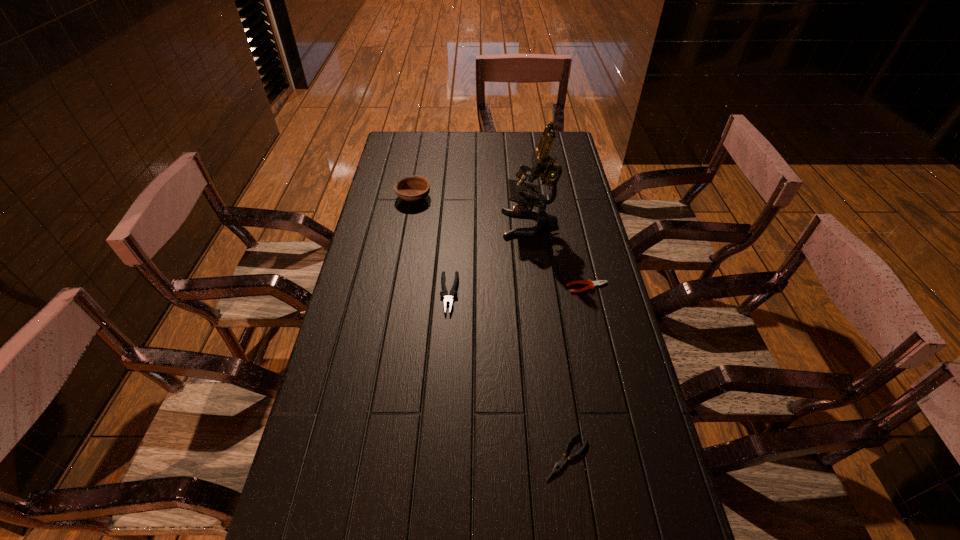
This screenshot has height=540, width=960. In order to click on free region at the right edge of the desktop in this screenshot , I will do `click(560, 192)`.

Locate an element on the screen. The image size is (960, 540). free space between the second farthest object and the leftmost object is located at coordinates (471, 211).

Where is `empty space that is in between the nearest object and the leftmost pliers`? The image size is (960, 540). empty space that is in between the nearest object and the leftmost pliers is located at coordinates (508, 375).

At what (x,y) coordinates should I click in order to perform the action: click on vacant area that lies between the rightmost pliers and the fourth nearest object. Please return your answer as a coordinate pair (x, y). The height and width of the screenshot is (540, 960). Looking at the image, I should click on (559, 256).

The image size is (960, 540). In order to click on vacant area that lies between the leftmost object and the tallest pliers in this screenshot , I will do `click(431, 245)`.

The image size is (960, 540). I want to click on empty location between the nearest pliers and the fourth nearest object, so click(x=548, y=341).

Where is `vacant area that lies between the microscope and the nearest pliers`? vacant area that lies between the microscope and the nearest pliers is located at coordinates (x=548, y=341).

In order to click on vacant space that is in between the third shortest object and the rightmost pliers in this screenshot , I will do `click(518, 291)`.

Where is `vacant area that lies between the farthest object and the rightmost pliers`? vacant area that lies between the farthest object and the rightmost pliers is located at coordinates (500, 242).

Locate an element on the screen. The image size is (960, 540). free space between the third tallest object and the rightmost pliers is located at coordinates (518, 291).